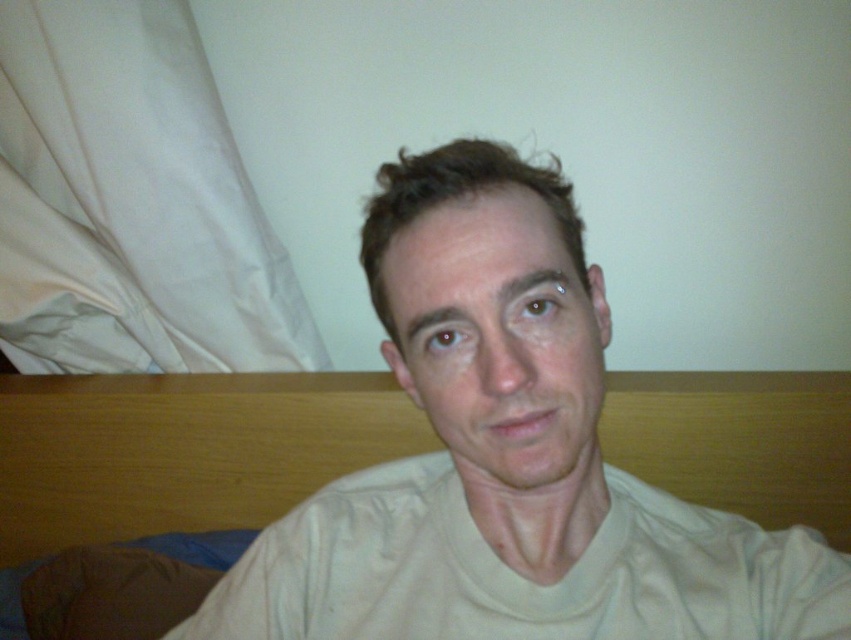
Question: Which point is farther from the camera taking this photo?

Choices:
 (A) (1, 492)
 (B) (506, 294)

Answer: (A)

Question: Can you confirm if light beige cotton shirt at center is positioned to the right of wooden bed at center?

Choices:
 (A) yes
 (B) no

Answer: (A)

Question: Does light beige cotton shirt at center appear on the left side of wooden bed at center?

Choices:
 (A) yes
 (B) no

Answer: (B)

Question: Which of the following is the closest to the observer?

Choices:
 (A) wooden bed at center
 (B) light beige cotton shirt at center

Answer: (B)

Question: Does light beige cotton shirt at center have a greater width compared to wooden bed at center?

Choices:
 (A) yes
 (B) no

Answer: (B)

Question: Which of the following is the closest to the observer?

Choices:
 (A) (758, 545)
 (B) (10, 467)

Answer: (A)